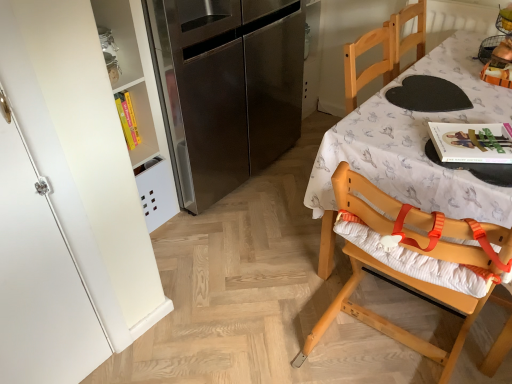
Question: Is wooden chair at right in front of or behind white matte cabinet at left in the image?

Choices:
 (A) behind
 (B) front

Answer: (A)

Question: From a real-world perspective, relative to white matte cabinet at left, is wooden chair at right vertically above or below?

Choices:
 (A) below
 (B) above

Answer: (A)

Question: Considering the real-world distances, which object is closest to the stainless steel refrigerator at left?

Choices:
 (A) wooden chair at right
 (B) white matte cabinet at left
 (C) wooden highchair at right

Answer: (A)

Question: Based on their relative distances, which object is farther from the wooden chair at right?

Choices:
 (A) wooden highchair at right
 (B) white matte cabinet at left
 (C) stainless steel refrigerator at left

Answer: (B)